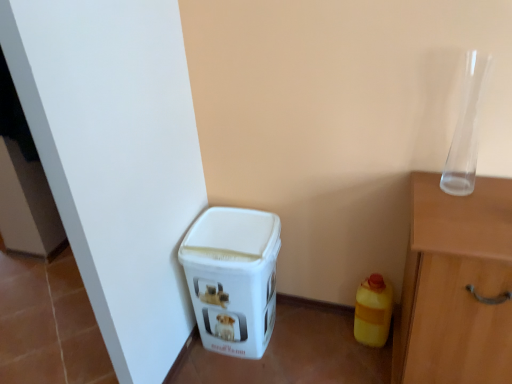
Where is `free space above white plastic bin at lower left (from a real-world perspective)`? free space above white plastic bin at lower left (from a real-world perspective) is located at coordinates (229, 222).